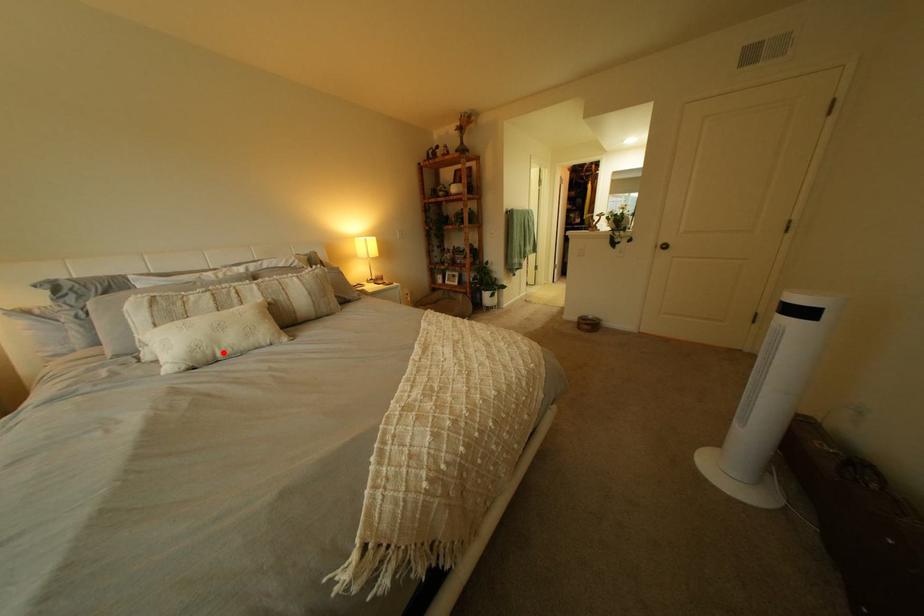
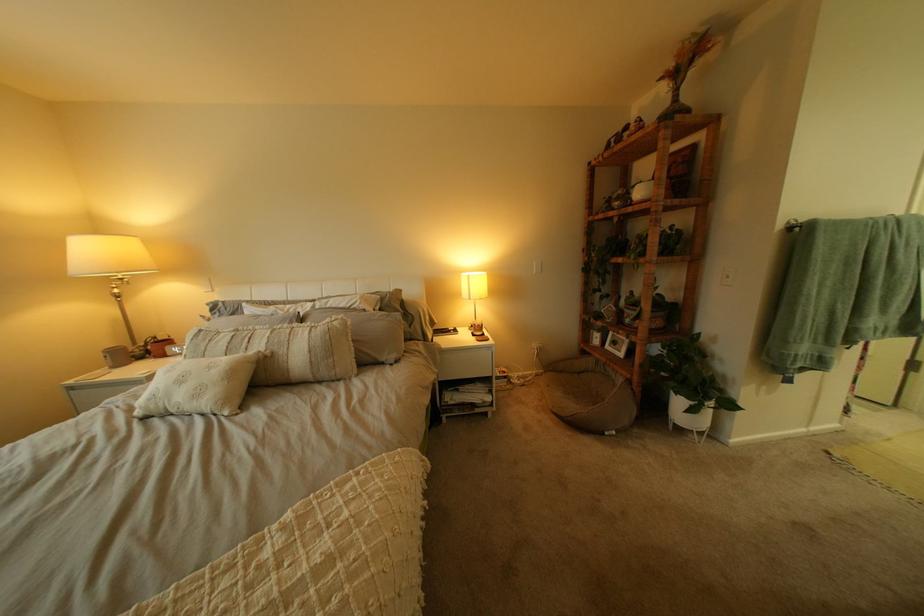
Question: I am providing you with two images of the same scene from different viewpoints. A red point is marked on the first image. Can you still see the location of the red point in image 2?

Choices:
 (A) Yes
 (B) No

Answer: (A)